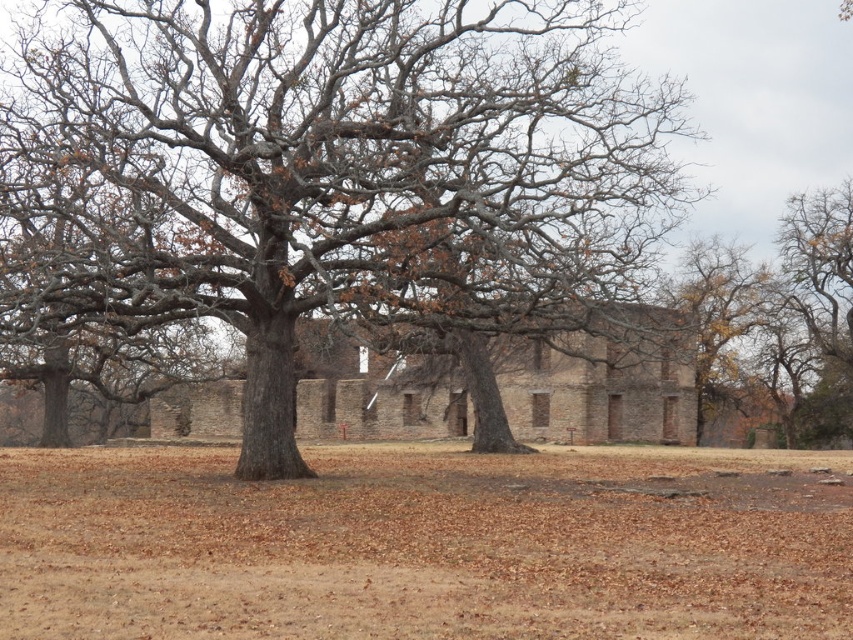
You are standing in the middle of a field and see the brown rough bark tree at center and the brown dry grass at center. Which object is closer to you?

The brown rough bark tree at center is closer to you because the brown dry grass at center is behind it.

You are a painter setting up an easel to paint the scene. You want to focus on the largest object in the center. Which object should you choose between the brown rough bark tree at center and the brown dry grass at center?

The brown rough bark tree at center is bigger than the brown dry grass at center, so you should focus on painting the brown rough bark tree at center as it is the largest object in the center.

You are standing at the center of the image. Where is the brown rough bark tree at center located relative to your position?

The brown rough bark tree at center is located at point (334, 177) relative to the center of the image.